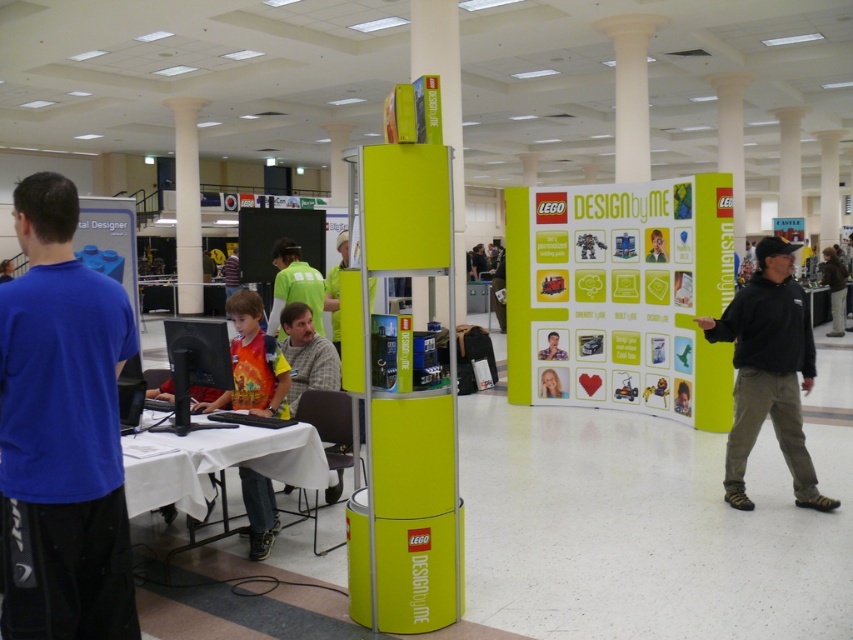
Question: Is the position of orange t-shirt at center more distant than that of smooth plastic face at center?

Choices:
 (A) yes
 (B) no

Answer: (B)

Question: Which of the following is the farthest from the observer?

Choices:
 (A) white cloth-covered table at center
 (B) blue cotton shirt at left
 (C) matte plastic face at center

Answer: (C)

Question: Which object appears farthest from the camera in this image?

Choices:
 (A) orange t-shirt at center
 (B) smooth plastic face at center

Answer: (B)

Question: Is black cotton hoodie at right to the left of light blue shirt at center from the viewer's perspective?

Choices:
 (A) no
 (B) yes

Answer: (A)

Question: Based on their relative distances, which object is farther from the yellow-green shirt at center?

Choices:
 (A) smooth plastic face at center
 (B) black glossy monitor at center
 (C) white cloth-covered table at center
 (D) matte plastic face at center

Answer: (B)

Question: Is blue cotton shirt at left below blue shirt at left?

Choices:
 (A) yes
 (B) no

Answer: (A)